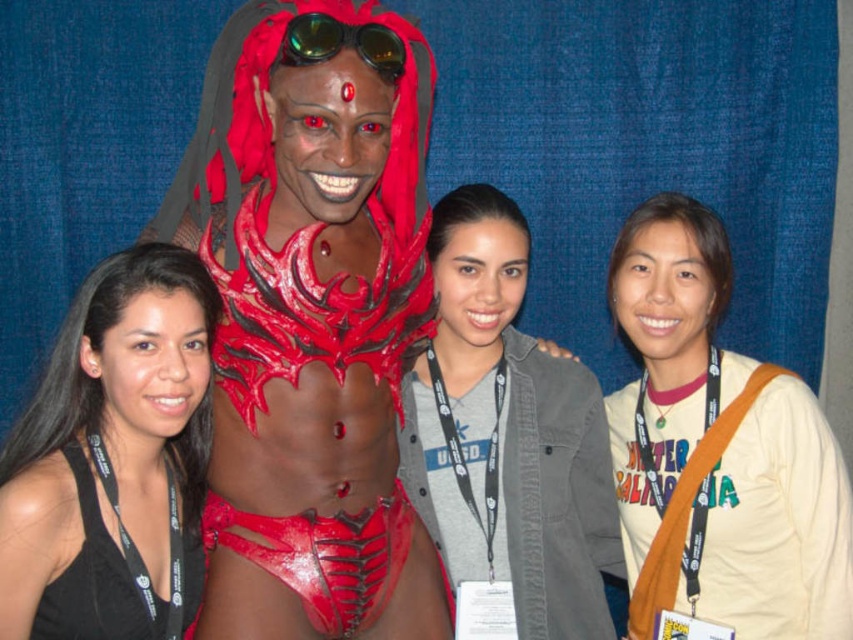
Is point (646, 525) more distant than point (526, 513)?

That is True.

Which of these two, white cotton t-shirt at center or gray cotton shirt at center, stands shorter?

Standing shorter between the two is gray cotton shirt at center.

Between point (677, 358) and point (578, 556), which one is positioned in front?

Positioned in front is point (578, 556).

At what (x,y) coordinates should I click in order to perform the action: click on white cotton t-shirt at center. Please return your answer as a coordinate pair (x, y). The image size is (853, 640). Looking at the image, I should click on (718, 451).

Which of these two, matte red body paint at center or green reflective plastic goggles at upper center, stands shorter?

Standing shorter between the two is green reflective plastic goggles at upper center.

Is point (328, 264) positioned after point (297, 19)?

Yes, it is behind point (297, 19).

Is point (338, 298) in front of point (335, 29)?

No, (338, 298) is behind (335, 29).

The image size is (853, 640). In order to click on matte red body paint at center in this screenshot , I will do `click(311, 321)`.

Does black matte tank top at left have a lesser height compared to green reflective plastic goggles at upper center?

Incorrect, black matte tank top at left's height does not fall short of green reflective plastic goggles at upper center's.

Image resolution: width=853 pixels, height=640 pixels. What are the coordinates of `black matte tank top at left` in the screenshot? It's located at (109, 440).